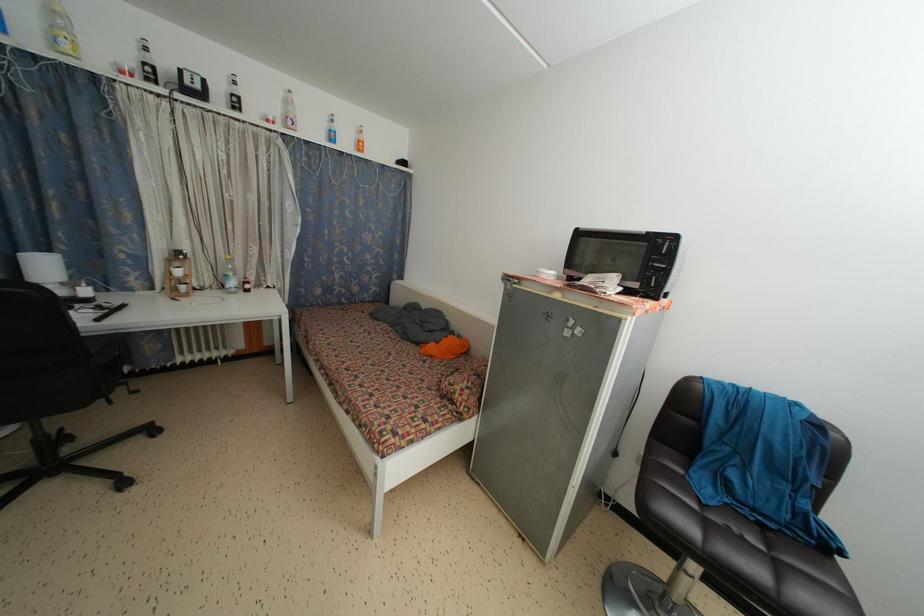
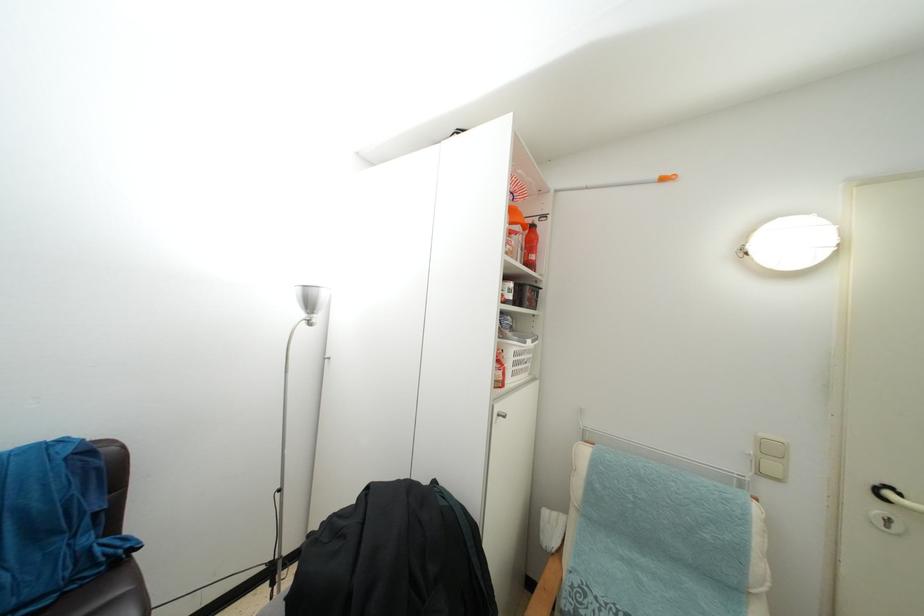
Question: The camera is either moving clockwise (left) or counter-clockwise (right) around the object. The first image is from the beginning of the video and the second image is from the end. Is the camera moving left or right when shooting the video?

Choices:
 (A) Left
 (B) Right

Answer: (A)